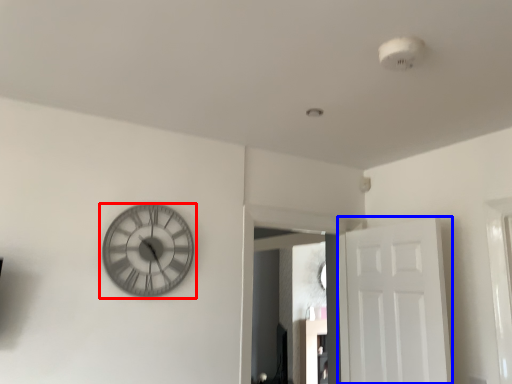
Question: Which point is closer to the camera, wall clock (highlighted by a red box) or door (highlighted by a blue box)?

Choices:
 (A) wall clock
 (B) door

Answer: (A)